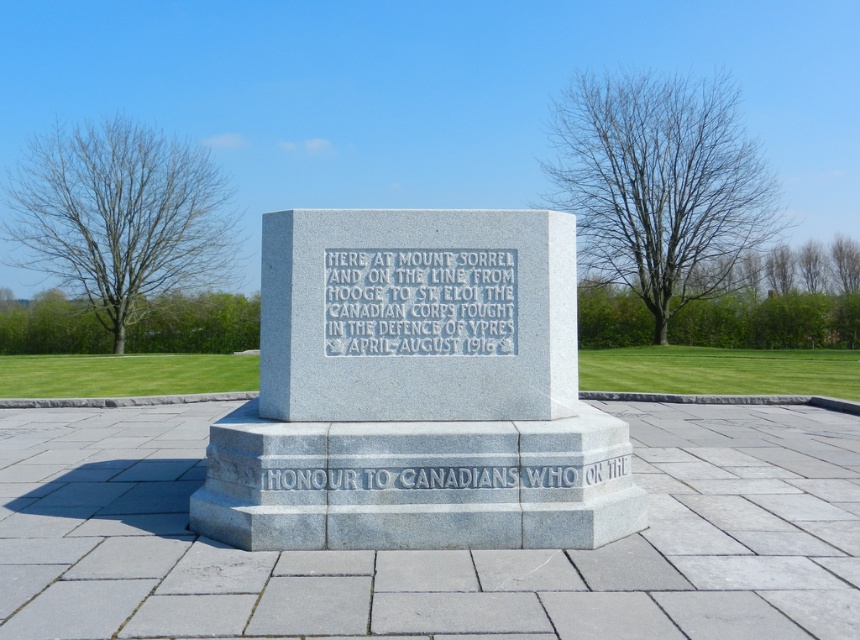
Between point (216, 468) and point (483, 324), which one is positioned in front?

Point (216, 468) is in front.

Does point (430, 528) come behind point (385, 298)?

No, (430, 528) is in front of (385, 298).

Locate an element on the screen. The height and width of the screenshot is (640, 860). gray stone monument at center is located at coordinates (x=416, y=392).